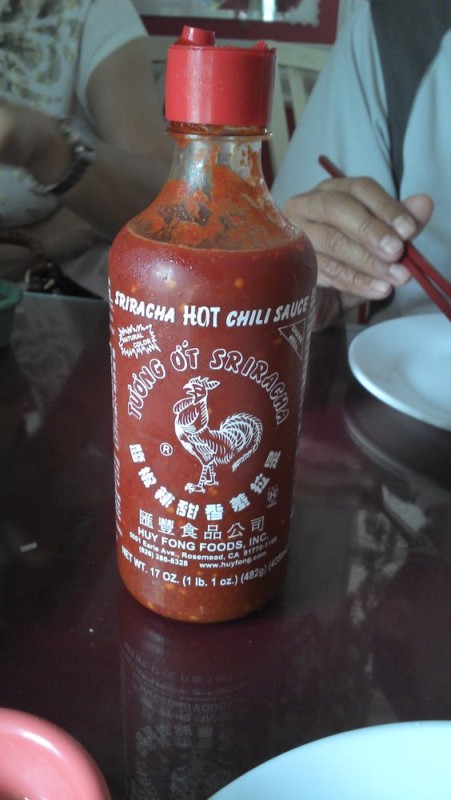
Find the location of a particular element. chopsticks is located at coordinates (431, 273), (440, 302).